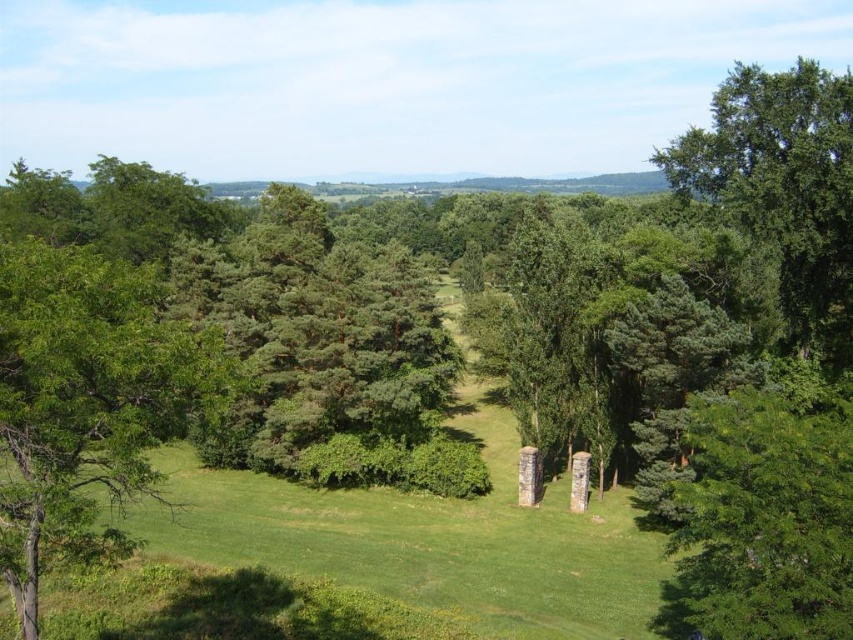
Question: Based on their relative distances, which object is nearer to the green leafy tree at upper right?

Choices:
 (A) green leafy tree at left
 (B) smooth stone pillar at center

Answer: (B)

Question: Is green leafy tree at upper right above smooth stone pillar at center?

Choices:
 (A) yes
 (B) no

Answer: (A)

Question: Does green leafy tree at left have a lesser width compared to smooth stone pillar at center?

Choices:
 (A) yes
 (B) no

Answer: (B)

Question: Observing the image, what is the correct spatial positioning of green leafy tree at upper right in reference to smooth stone pillar at center?

Choices:
 (A) left
 (B) right

Answer: (B)

Question: Which of the following is the closest to the observer?

Choices:
 (A) click(532, 481)
 (B) click(828, 573)
 (C) click(589, 481)

Answer: (B)

Question: Among these points, which one is nearest to the camera?

Choices:
 (A) (741, 544)
 (B) (520, 490)
 (C) (573, 483)
 (D) (70, 484)

Answer: (D)